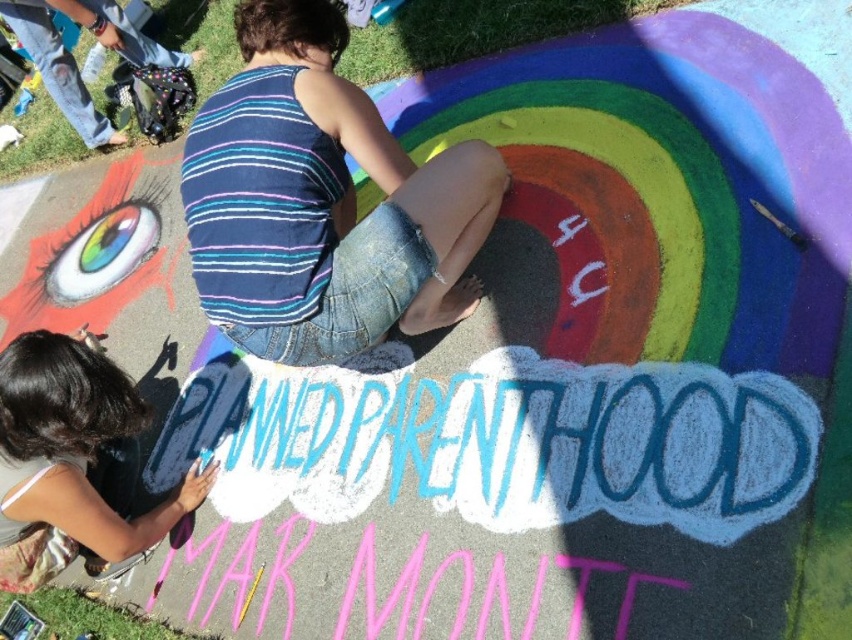
Can you confirm if blue striped tank top at center is wider than smooth black hair at upper left?

Indeed, blue striped tank top at center has a greater width compared to smooth black hair at upper left.

Is blue striped tank top at center taller than smooth black hair at upper left?

Indeed, blue striped tank top at center has a greater height compared to smooth black hair at upper left.

Which is behind, point (262, 156) or point (160, 536)?

The point (160, 536) is more distant.

The image size is (852, 640). Find the location of `blue striped tank top at center`. blue striped tank top at center is located at coordinates (321, 202).